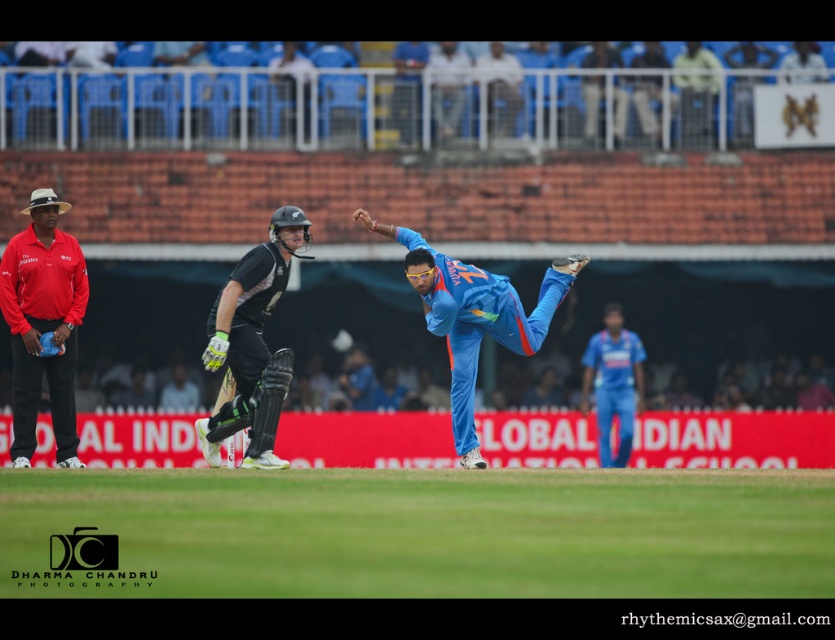
You are a spectator at the cricket match and notice a specific point marked at coordinates (474, 316). Which player is this point located on?

The point at (474, 316) is on the blue fabric cricket uniform at center, which belongs to the bowler in blue uniform mid action delivering the ball.

You are a photographer at the cricket match and want to capture both the red cotton shirt at left and the blue fabric player at center in a single frame. Given their sizes in the image, which object should you focus on to ensure both are clearly visible?

The red cotton shirt at left occupies less space than the blue fabric player at center, so you should focus on the blue fabric player at center to ensure both are clearly visible as it is larger and will remain in focus while the smaller red cotton shirt at left will also be in the frame.

You are a fielder positioned at the point with coordinates (635,346). You see another fielder at point (464,369). Which fielder is closer to the bowler?

The fielder at point (464,369) is closer to the bowler because it is in front of the fielder at point (635,346).